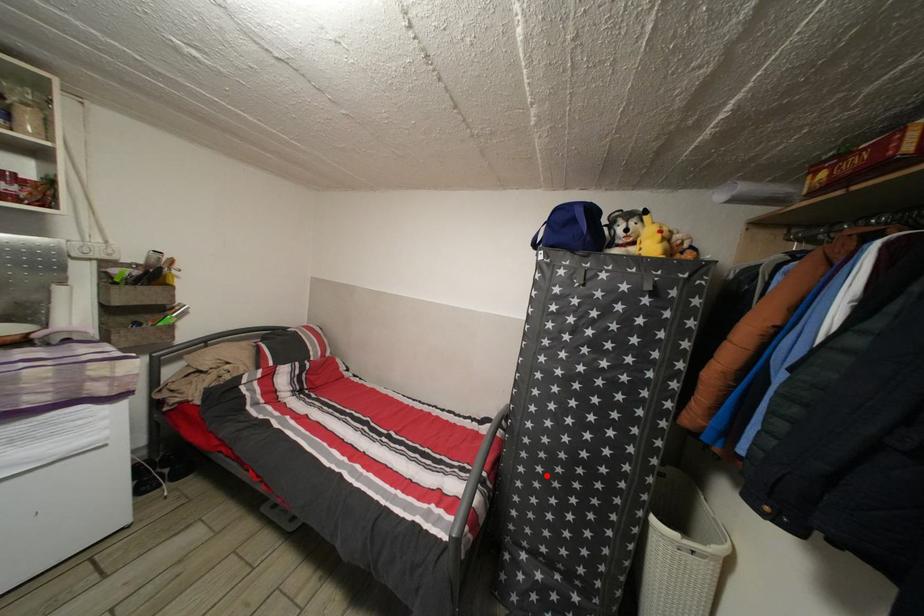
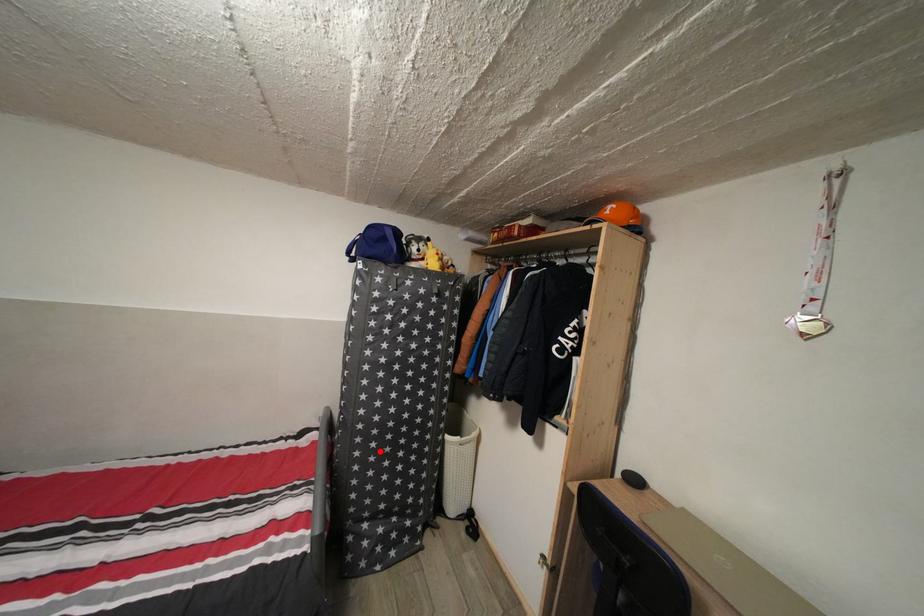
I am providing you with two images of the same scene from different viewpoints. A red point is marked on the first image and another point is marked on the second image. Are the points marked in image1 and image2 representing the same 3D position?

Yes